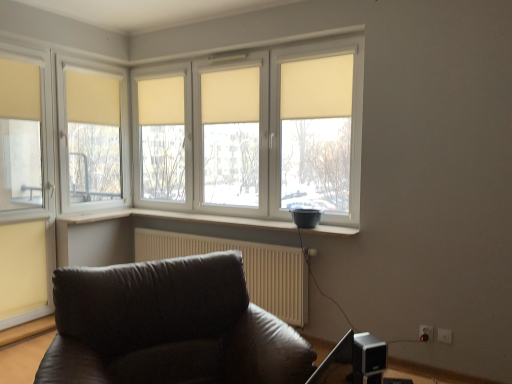
What are the coordinates of `blank space above beige fabric curtain at upper right, which appears as the 1th curtain when viewed from the right (from a real-world perspective)` in the screenshot? It's located at (317, 51).